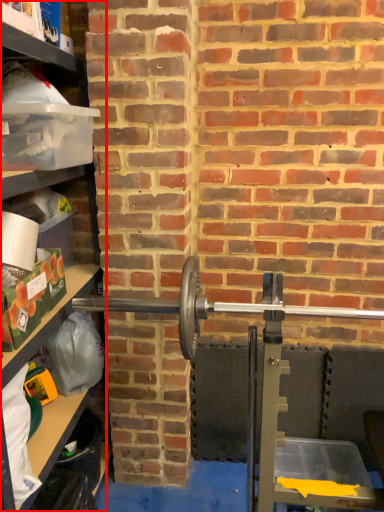
Question: Where is shelf (annotated by the red box) located in relation to barbell in the image?

Choices:
 (A) right
 (B) left

Answer: (B)